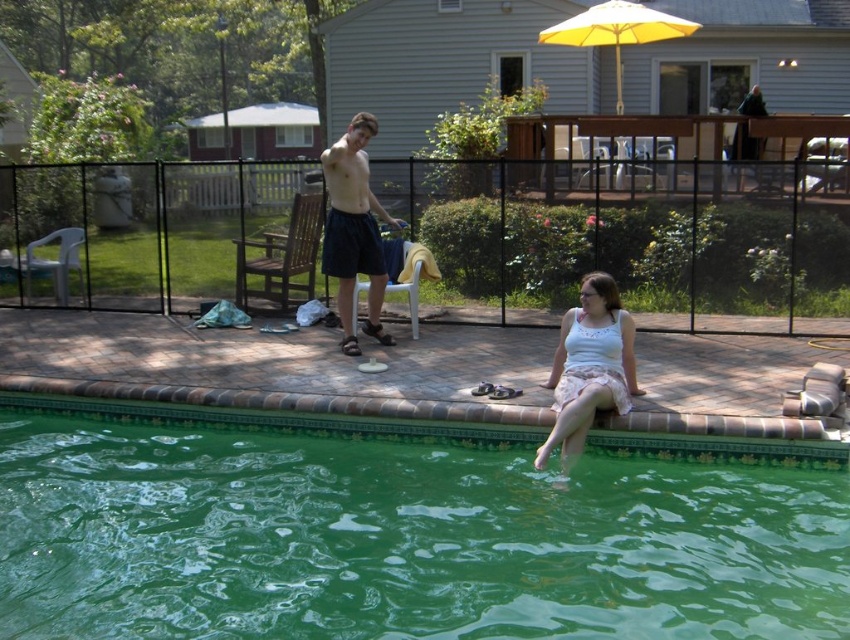
Looking at this image, is white lace dress at lower right positioned at the back of dark blue shorts at center?

No, it is not.

Does white lace dress at lower right have a smaller size compared to dark blue shorts at center?

Yes, white lace dress at lower right is smaller than dark blue shorts at center.

Between point (588, 336) and point (357, 184), which one is positioned behind?

Point (357, 184)

You are a GUI agent. You are given a task and a screenshot of the screen. Output one action in this format:
    pyautogui.click(x=<x>, y=<y>)
    Task: Click on the white lace dress at lower right
    The height and width of the screenshot is (640, 850).
    Given the screenshot: What is the action you would take?
    pyautogui.click(x=588, y=365)

Is green glossy water at lower center below dark blue shorts at center?

Yes.

Can you confirm if green glossy water at lower center is positioned to the left of dark blue shorts at center?

In fact, green glossy water at lower center is to the right of dark blue shorts at center.

Between point (129, 634) and point (332, 246), which one is positioned behind?

Point (332, 246)

Locate an element on the screen. green glossy water at lower center is located at coordinates (401, 540).

Is point (769, 497) behind point (576, 456)?

No, it is not.

Between green glossy water at lower center and white lace dress at lower right, which one is positioned lower?

Positioned lower is green glossy water at lower center.

Locate an element on the screen. green glossy water at lower center is located at coordinates (401, 540).